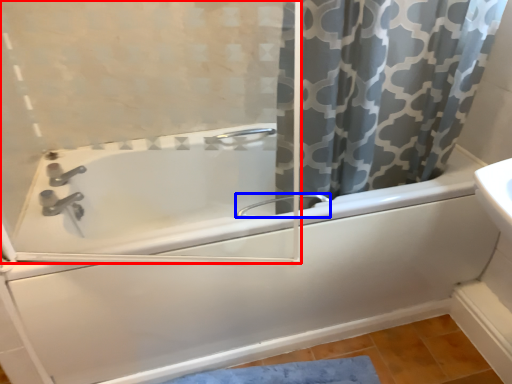
Question: Which object is further to the camera taking this photo, screen door (highlighted by a red box) or faucet (highlighted by a blue box)?

Choices:
 (A) screen door
 (B) faucet

Answer: (B)